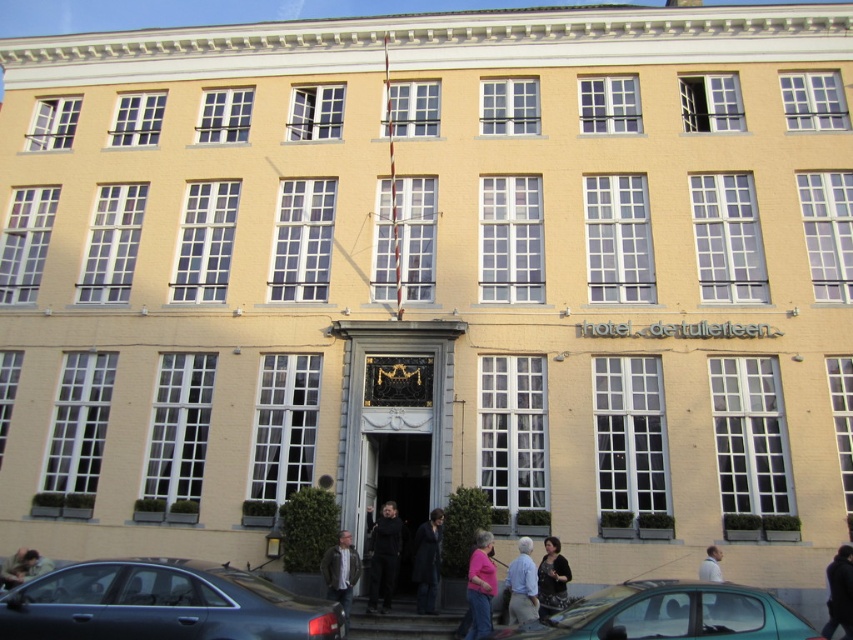
Can you confirm if gray metallic door at center is thinner than light blue shirt at lower center?

Incorrect, gray metallic door at center's width is not less than light blue shirt at lower center's.

Between point (409, 404) and point (519, 566), which one is positioned behind?

The point (409, 404) is more distant.

Identify the location of gray metallic door at center. The height and width of the screenshot is (640, 853). (395, 417).

Is point (744, 596) farther from camera compared to point (431, 557)?

No, it is not.

Who is shorter, teal glossy car at lower center or dark gray coat at center?

dark gray coat at center is shorter.

The width and height of the screenshot is (853, 640). What are the coordinates of `teal glossy car at lower center` in the screenshot? It's located at tap(670, 614).

Who is shorter, matte black sedan at lower left or light blue shirt at lower center?

light blue shirt at lower center is shorter.

Between matte black sedan at lower left and light blue shirt at lower center, which one appears on the right side from the viewer's perspective?

From the viewer's perspective, light blue shirt at lower center appears more on the right side.

Who is more distant from viewer, (x=9, y=604) or (x=503, y=582)?

Positioned behind is point (x=503, y=582).

The width and height of the screenshot is (853, 640). In order to click on matte black sedan at lower left in this screenshot , I will do `click(161, 604)`.